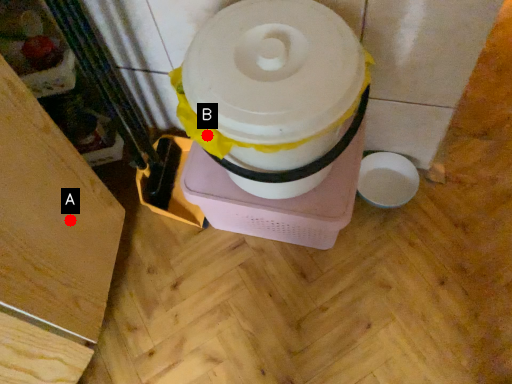
Question: Two points are circled on the image, labeled by A and B beside each circle. Which point appears farthest from the camera in this image?

Choices:
 (A) A is further
 (B) B is further

Answer: (A)